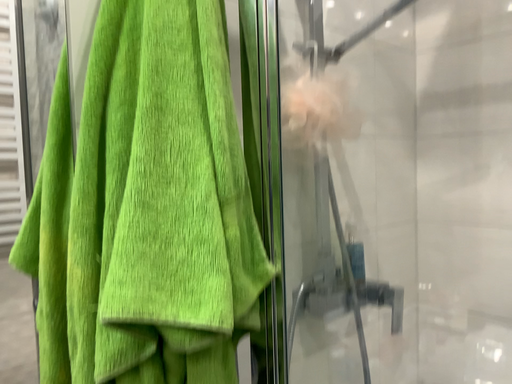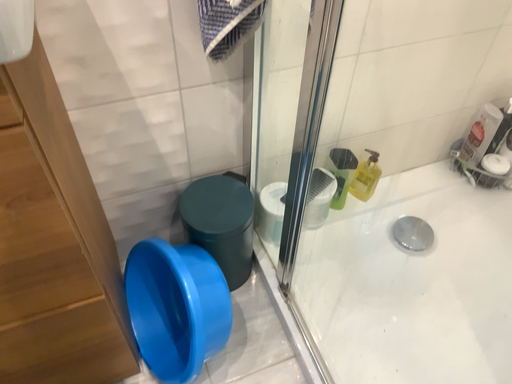
Question: Which way did the camera rotate in the video?

Choices:
 (A) rotated upward
 (B) rotated downward

Answer: (B)